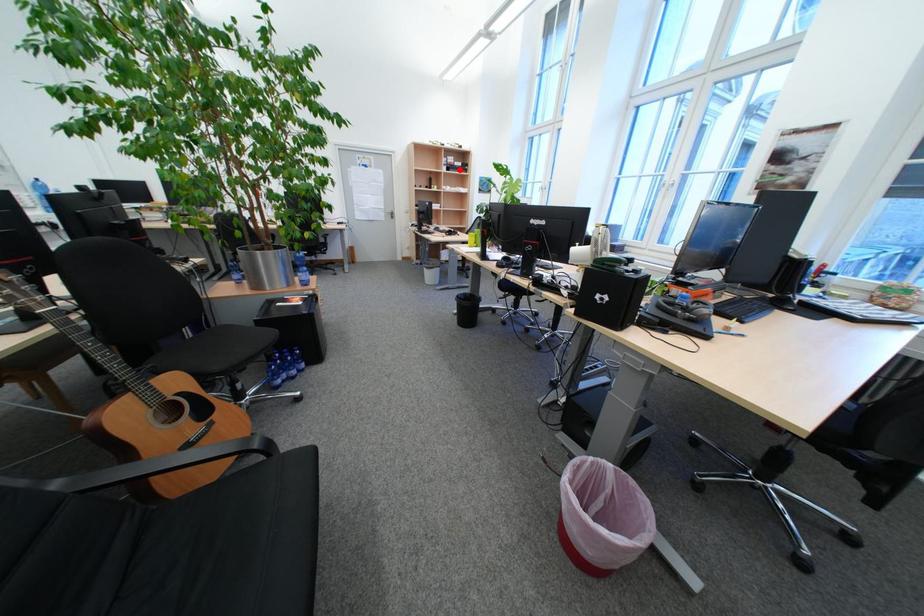
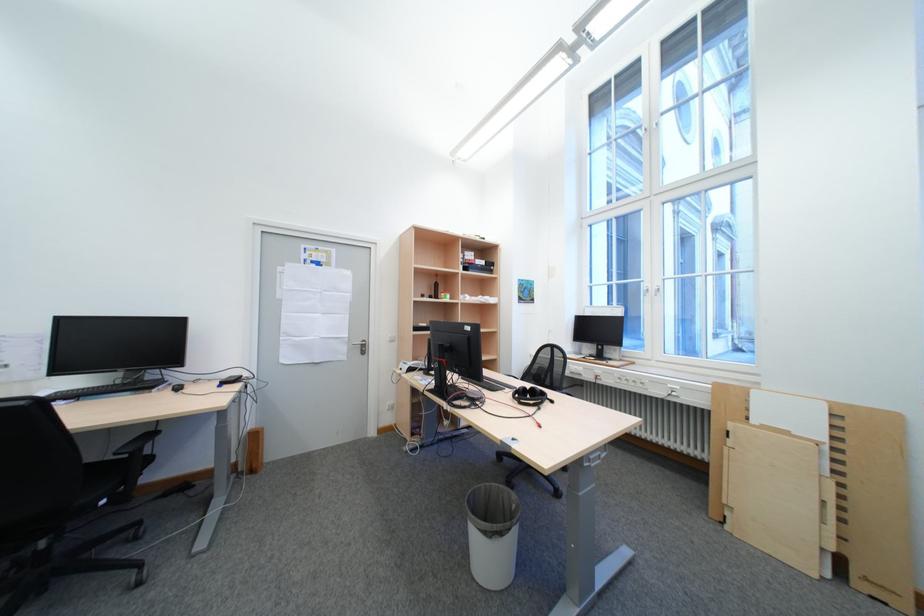
Question: I am providing you with two images of the same scene from different viewpoints. Image1 has a red point marked. In image2, the corresponding 3D location appears at what relative position? Reply with the corresponding letter.

Choices:
 (A) Closer
 (B) Farther

Answer: (B)